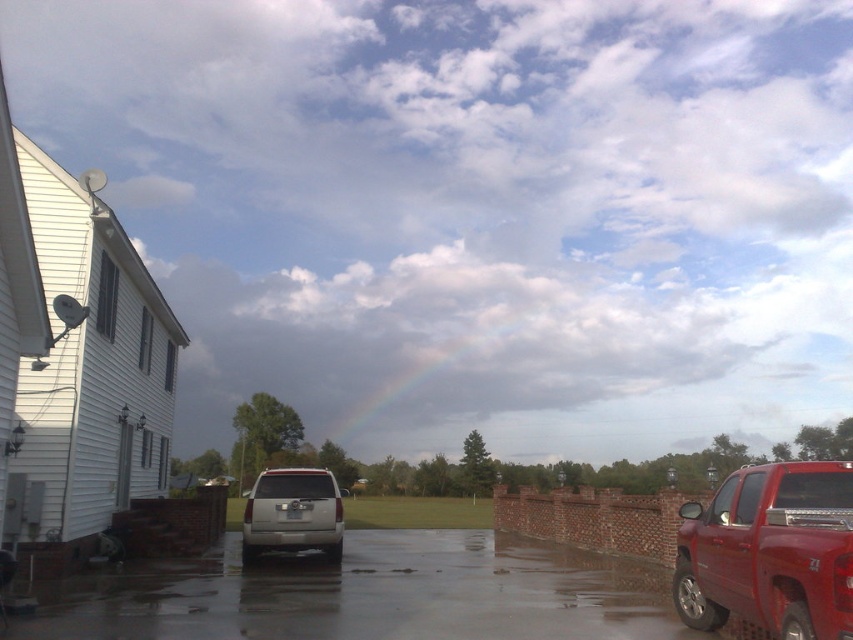
You are a delivery driver who needs to park your vehicle in the driveway. The glossy red truck at right and the satin silver suv at center are already parked there. Which vehicle takes up more space in the driveway?

The satin silver suv at center occupies more space than the glossy red truck at right, so the satin silver suv at center takes up more space in the driveway.

You are a delivery person with a 12 feet long truck. You need to park your truck on the glossy asphalt driveway at center without overlapping with the glossy red truck at right. Is there enough space?

The glossy asphalt driveway at center and glossy red truck at right are 13.53 feet apart, so yes, the delivery person can park their 12 feet long truck on the glossy asphalt driveway at center without overlapping since the distance between them is greater than the truck length.